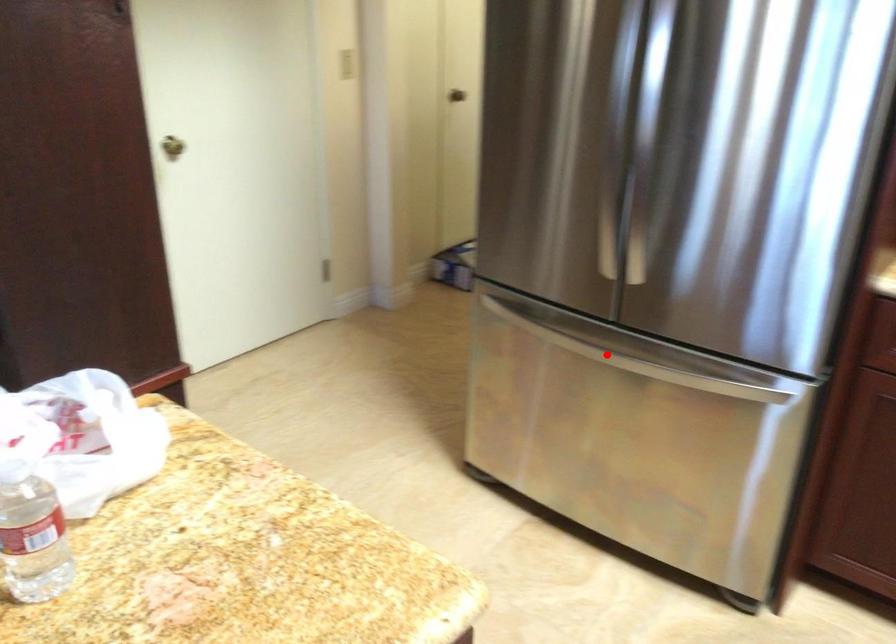
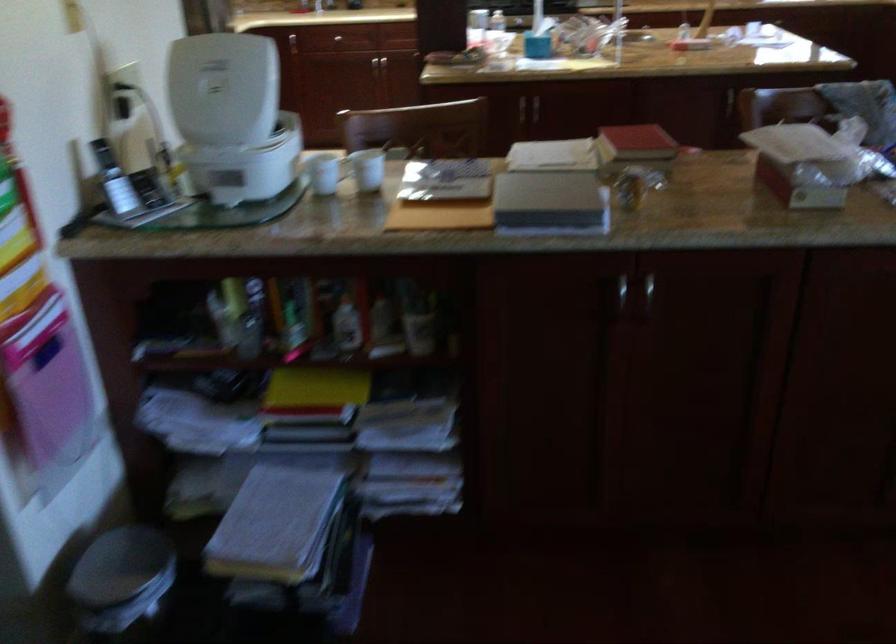
Question: I am providing you with two images of the same scene from different viewpoints. A red point is marked on the first image. Is the red point's position out of view in image 2?

Choices:
 (A) Yes
 (B) No

Answer: (A)